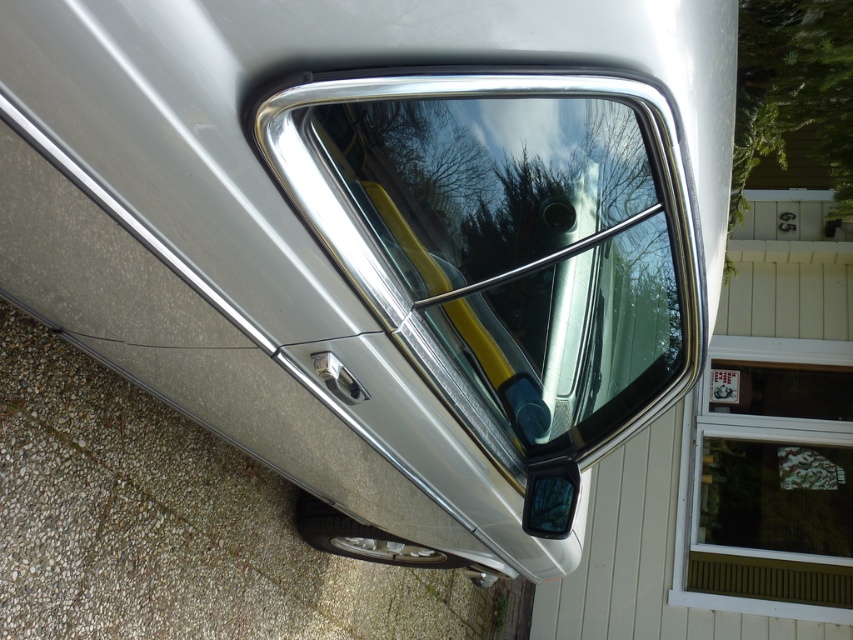
You are a delivery person trying to place a package on the ground between the polished chrome window at center and the white plastic window at upper right. What is the minimum distance you need to cover to place the package between them?

The minimum distance you need to cover to place the package between the polished chrome window at center and the white plastic window at upper right is 4.60 meters, as they are 4.60 meters apart from each other.

You are standing in front of the silver car and want to check both the white plastic window at upper right and the glossy plastic mirror at lower right. Which object is positioned more to the east if the car is facing north?

The white plastic window at upper right is positioned more to the east because it is to the right of the glossy plastic mirror at lower right, and since the car is facing north, the right side of the car would be east.